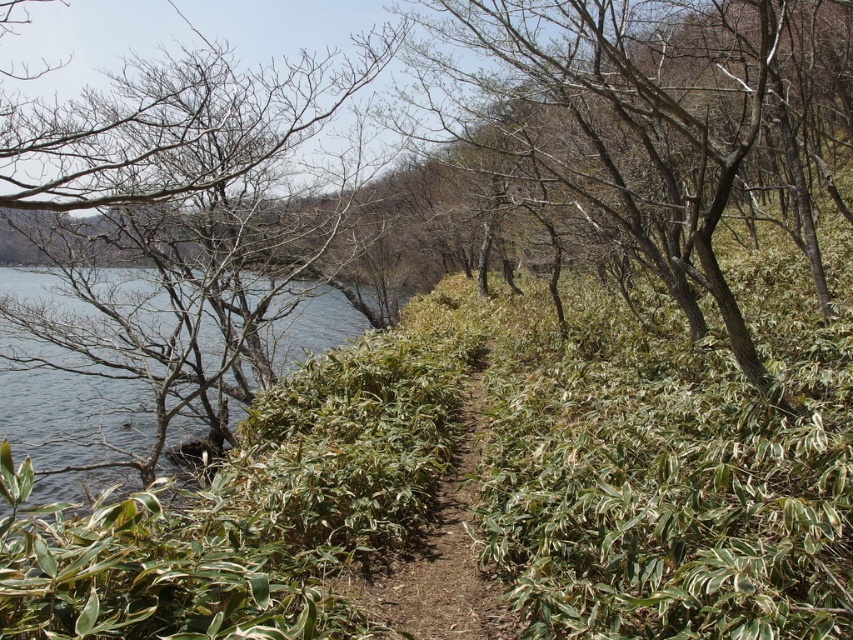
Question: Is green leafy shrub at center bigger than brown dirt path at center?

Choices:
 (A) yes
 (B) no

Answer: (A)

Question: From the image, what is the correct spatial relationship of green leafy shrub at center in relation to green leafy shrubs at left?

Choices:
 (A) below
 (B) above

Answer: (B)

Question: Among these points, which one is farthest from the camera?

Choices:
 (A) (73, 461)
 (B) (674, 150)
 (C) (440, 547)

Answer: (B)

Question: Which is farther from the green leafy shrub at center?

Choices:
 (A) bare branches at left
 (B) brown dirt path at center

Answer: (B)

Question: Which object is positioned farthest from the brown dirt path at center?

Choices:
 (A) green leafy shrubs at left
 (B) bare branches at left

Answer: (A)

Question: From the image, what is the correct spatial relationship of bare branches at left in relation to brown dirt path at center?

Choices:
 (A) left
 (B) right

Answer: (A)